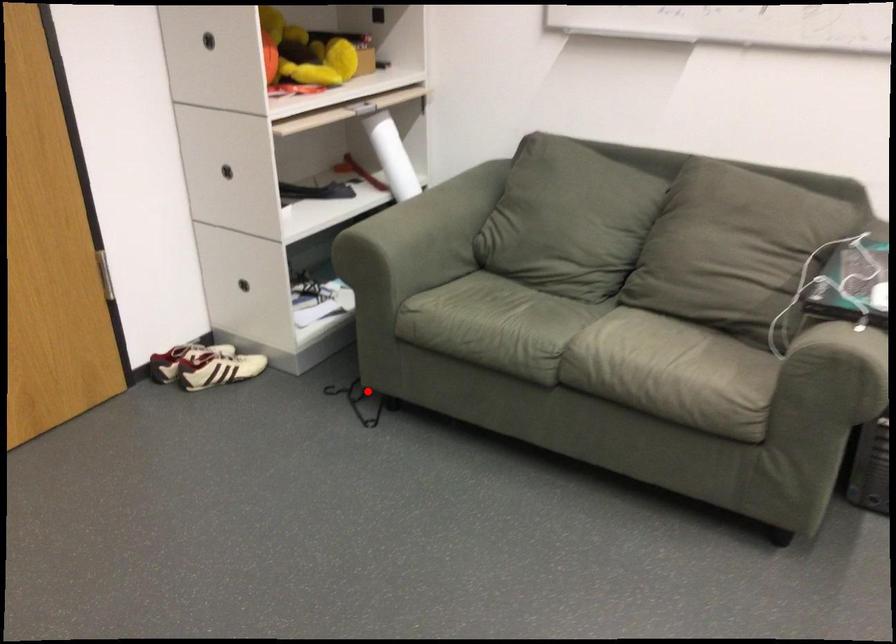
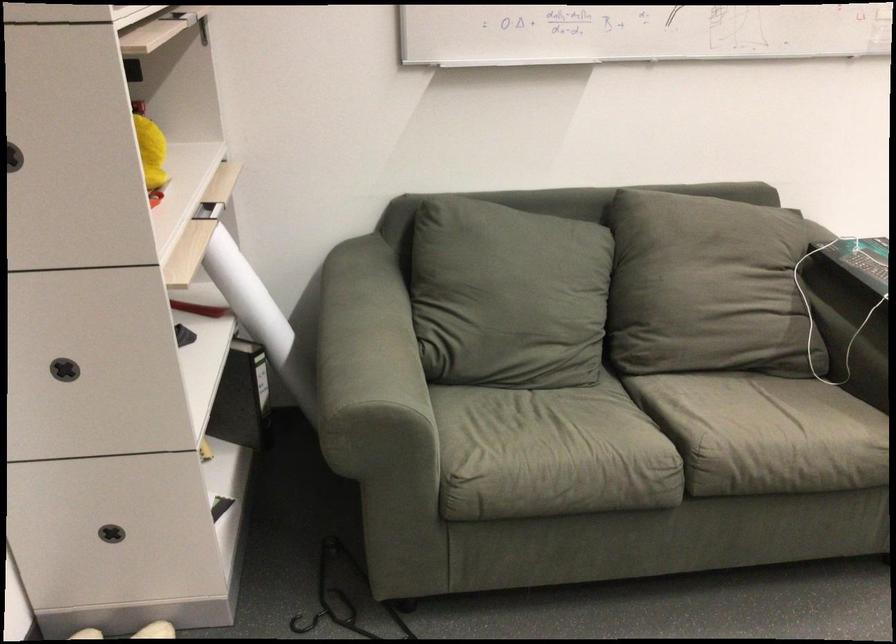
Locate, in the second image, the point that corresponds to the highlighted location in the first image.

(341, 598)